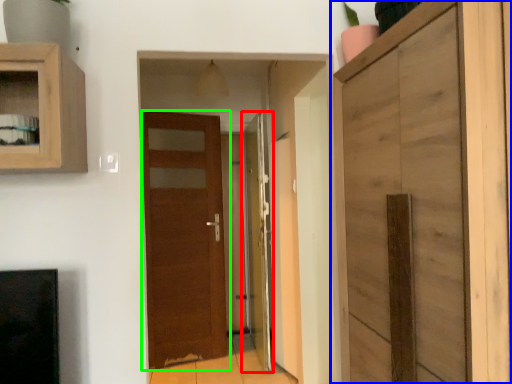
Question: Which object is the closest to the door (highlighted by a red box)? Choose among these: cupboard (highlighted by a blue box) or door (highlighted by a green box).

Choices:
 (A) cupboard
 (B) door

Answer: (B)